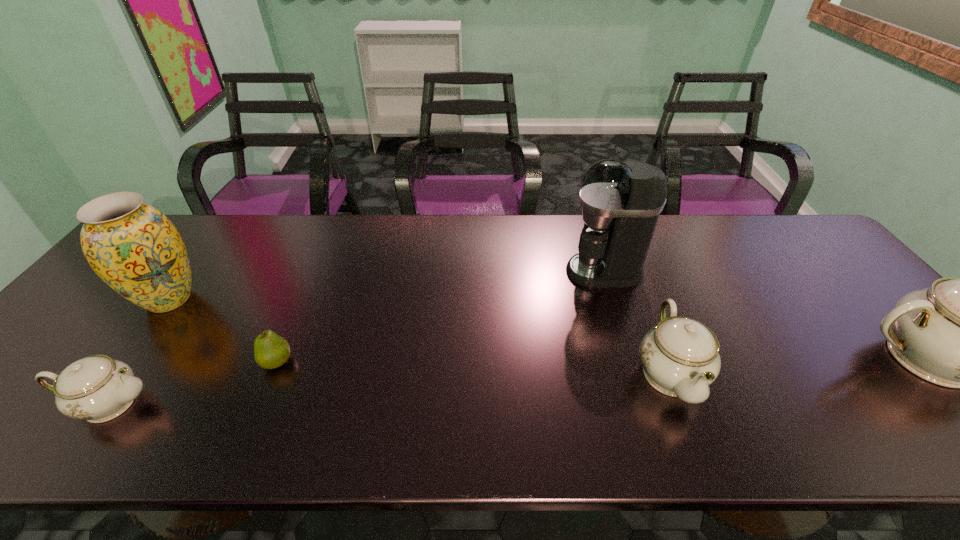
Identify the location of free spot located place cup under the spout of the coffee maker. This screenshot has height=540, width=960. (455, 272).

At what (x,y) coordinates should I click in order to perform the action: click on free space located 0.380m place cup under the spout of the coffee maker. Please return your answer as a coordinate pair (x, y). The width and height of the screenshot is (960, 540). Looking at the image, I should click on (435, 272).

The width and height of the screenshot is (960, 540). Find the location of `vacant space located 0.390m on the right of the second tallest object`. vacant space located 0.390m on the right of the second tallest object is located at coordinates click(x=349, y=300).

I want to click on free region located 0.360m on the back of the shortest object, so click(323, 255).

Image resolution: width=960 pixels, height=540 pixels. In order to click on object present at the far edge in this screenshot , I will do `click(621, 202)`.

At what (x,y) coordinates should I click in order to perform the action: click on pear that is positioned at the near edge. Please return your answer as a coordinate pair (x, y). This screenshot has height=540, width=960. Looking at the image, I should click on (271, 351).

The image size is (960, 540). Identify the location of chinaware located at the left edge. (97, 388).

Identify the location of vase that is at the left edge. The height and width of the screenshot is (540, 960). (134, 248).

Identify the location of object that is at the near left corner. (97, 388).

Image resolution: width=960 pixels, height=540 pixels. I want to click on free space at the far edge, so click(x=663, y=226).